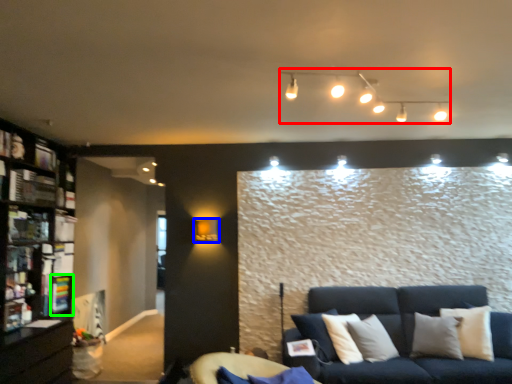
Question: Which object is positioned closest to lamp (highlighted by a red box)? Select from lamp (highlighted by a blue box) and shelf (highlighted by a green box).

Choices:
 (A) lamp
 (B) shelf

Answer: (A)